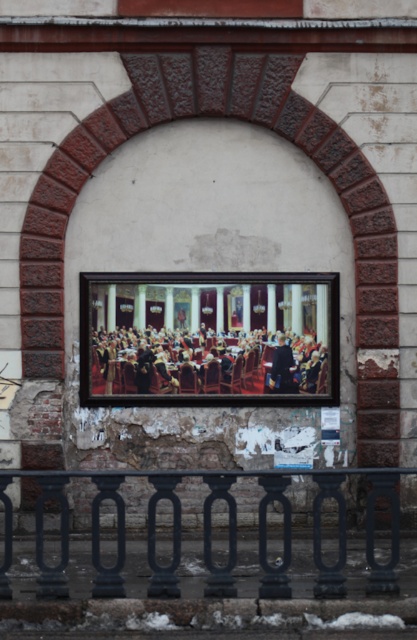
Question: Which point is farther to the camera?

Choices:
 (A) formal attire person at center
 (B) smooth black railing at lower center

Answer: (A)

Question: Is smooth black railing at lower center further to camera compared to dark blue suit at center?

Choices:
 (A) no
 (B) yes

Answer: (A)

Question: Does smooth black railing at lower center appear under formal attire person at center?

Choices:
 (A) no
 (B) yes

Answer: (B)

Question: Does smooth black railing at lower center have a greater width compared to dark blue suit at center?

Choices:
 (A) yes
 (B) no

Answer: (A)

Question: Which object is the farthest from the dark blue suit at center?

Choices:
 (A) smooth black railing at lower center
 (B) formal attire person at center

Answer: (A)

Question: Which object appears farthest from the camera in this image?

Choices:
 (A) formal attire person at center
 (B) dark blue suit at center
 (C) smooth black railing at lower center

Answer: (B)